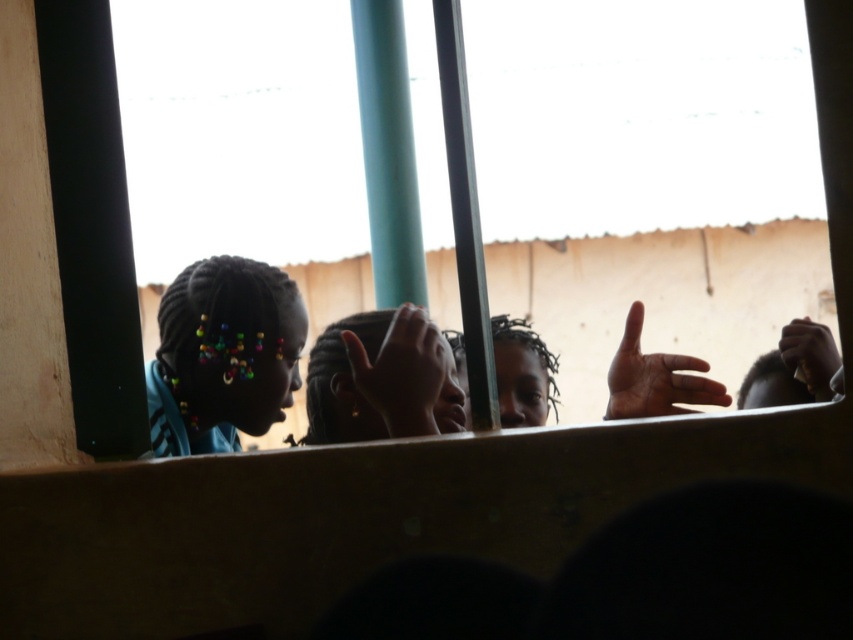
You are a window cleaner who needs to clean the transparent glass at upper center and the brown matte hand at center. Which object requires a taller ladder to reach?

The transparent glass at upper center requires a taller ladder because it is much taller than the brown matte hand at center.

You are a painter standing in front of the window. You notice the transparent glass at upper center and the smooth brown hand at right. Which object would block your view more if placed in front of you?

The transparent glass at upper center would block your view more than the smooth brown hand at right because it is larger in size.

You are a painter standing 6 feet away from the transparent glass at upper center. Can you reach the glass to paint on it?

The transparent glass at upper center is 7.08 feet away from the viewer. Since you are standing 6 feet away, you are close enough to reach the glass to paint on it.